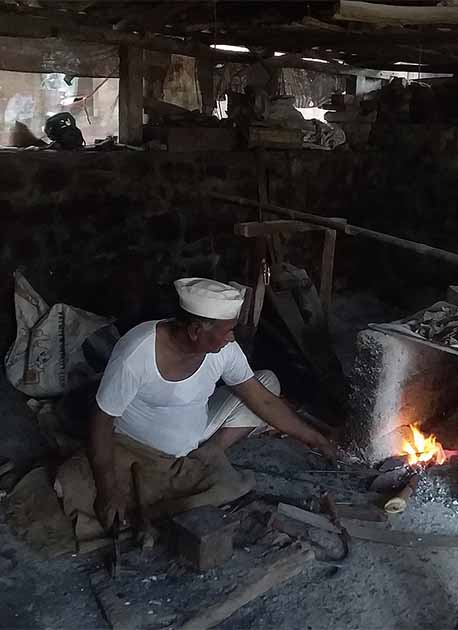
You are a GUI agent. You are given a task and a screenshot of the screen. Output one action in this format:
    pyautogui.click(x=<x>, y=<y>)
    Task: Click on the fireplace
    
    Given the screenshot: What is the action you would take?
    pyautogui.click(x=414, y=375)